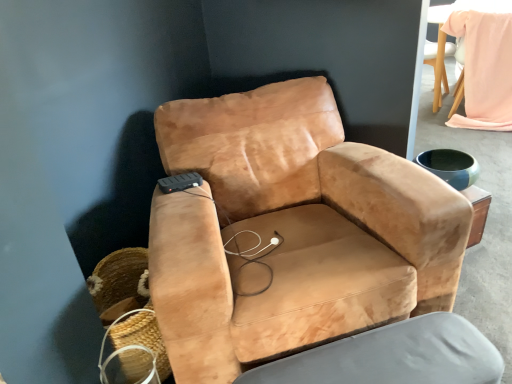
Image resolution: width=512 pixels, height=384 pixels. What do you see at coordinates (134, 350) in the screenshot? I see `woven straw basket at lower left` at bounding box center [134, 350].

The height and width of the screenshot is (384, 512). In order to click on woven straw basket at lower left in this screenshot , I will do `click(134, 350)`.

Is light pink fabric bean bag chair at upper right bigger than suede tan armchair at center?

Actually, light pink fabric bean bag chair at upper right might be smaller than suede tan armchair at center.

Is light pink fabric bean bag chair at upper right situated inside suede tan armchair at center or outside?

light pink fabric bean bag chair at upper right is spatially situated outside suede tan armchair at center.

Is the surface of light pink fabric bean bag chair at upper right in direct contact with suede tan armchair at center?

light pink fabric bean bag chair at upper right and suede tan armchair at center are not in contact.

From a real-world perspective, relative to suede tan armchair at center, is light pink fabric bean bag chair at upper right vertically above or below?

In terms of real-world spatial position, light pink fabric bean bag chair at upper right is below suede tan armchair at center.

From a real-world perspective, who is located lower, suede-like tan swivel chair at center or light pink fabric bean bag chair at upper right?

From a 3D spatial view, suede-like tan swivel chair at center is below.

Is light pink fabric bean bag chair at upper right at the back of suede-like tan swivel chair at center?

No, suede-like tan swivel chair at center is not facing the opposite direction of light pink fabric bean bag chair at upper right.

Looking at this image, between suede-like tan swivel chair at center and light pink fabric bean bag chair at upper right, which one has less height?

Standing shorter between the two is suede-like tan swivel chair at center.

The width and height of the screenshot is (512, 384). Find the location of `swivel chair that appears below the light pink fabric bean bag chair at upper right (from a real-world perspective)`. swivel chair that appears below the light pink fabric bean bag chair at upper right (from a real-world perspective) is located at coordinates (392, 356).

Which of these two, suede tan armchair at center or woven straw basket at lower left, stands shorter?

woven straw basket at lower left.

Considering the positions of objects suede tan armchair at center and woven straw basket at lower left in the image provided, who is in front, suede tan armchair at center or woven straw basket at lower left?

suede tan armchair at center is closer to the camera.

Considering the positions of objects suede tan armchair at center and woven straw basket at lower left in the image provided, who is more to the left, suede tan armchair at center or woven straw basket at lower left?

woven straw basket at lower left.

You are a GUI agent. You are given a task and a screenshot of the screen. Output one action in this format:
    pyautogui.click(x=<x>, y=<y>)
    Task: Click on the basket directly beneath the suede tan armchair at center (from a real-world perspective)
    
    Given the screenshot: What is the action you would take?
    click(x=134, y=350)

Who is bigger, suede tan armchair at center or suede-like tan swivel chair at center?

suede tan armchair at center.

Is suede tan armchair at center situated inside suede-like tan swivel chair at center or outside?

suede tan armchair at center is spatially situated outside suede-like tan swivel chair at center.

Which is behind, point (245, 205) or point (426, 370)?

The point (245, 205) is farther.

Is suede tan armchair at center next to suede-like tan swivel chair at center?

They are not placed beside each other.

From a real-world perspective, is woven straw basket at lower left above or below suede tan armchair at center?

In terms of real-world spatial position, woven straw basket at lower left is below suede tan armchair at center.

Considering the sizes of woven straw basket at lower left and suede tan armchair at center in the image, is woven straw basket at lower left wider or thinner than suede tan armchair at center?

Clearly, woven straw basket at lower left has less width compared to suede tan armchair at center.

Considering the points (138, 336) and (301, 209), which point is behind, point (138, 336) or point (301, 209)?

The point (301, 209) is more distant.

Identify the location of basket on the left of suede tan armchair at center. The height and width of the screenshot is (384, 512). (134, 350).

Is suede tan armchair at center wider than light pink fabric bean bag chair at upper right?

Indeed, suede tan armchair at center has a greater width compared to light pink fabric bean bag chair at upper right.

Is point (388, 273) more distant than point (472, 120)?

No, (388, 273) is in front of (472, 120).

Between suede tan armchair at center and light pink fabric bean bag chair at upper right, which one has more height?

suede tan armchair at center is taller.

Consider the image. Considering the positions of objects suede tan armchair at center and light pink fabric bean bag chair at upper right in the image provided, who is behind, suede tan armchair at center or light pink fabric bean bag chair at upper right?

light pink fabric bean bag chair at upper right is more distant.

Image resolution: width=512 pixels, height=384 pixels. Identify the location of basket on the left of light pink fabric bean bag chair at upper right. (134, 350).

Is woven straw basket at lower left wider than light pink fabric bean bag chair at upper right?

Incorrect, the width of woven straw basket at lower left does not surpass that of light pink fabric bean bag chair at upper right.

Is woven straw basket at lower left taller or shorter than light pink fabric bean bag chair at upper right?

Clearly, woven straw basket at lower left is shorter compared to light pink fabric bean bag chair at upper right.

Considering the sizes of objects woven straw basket at lower left and light pink fabric bean bag chair at upper right in the image provided, who is smaller, woven straw basket at lower left or light pink fabric bean bag chair at upper right?

woven straw basket at lower left.

This screenshot has height=384, width=512. I want to click on chair below the light pink fabric bean bag chair at upper right (from the image's perspective), so click(x=290, y=231).

Identify the location of bean bag chair lying behind the suede-like tan swivel chair at center. The width and height of the screenshot is (512, 384). (485, 69).

From the image, which object appears to be nearer to woven straw basket at lower left, light pink fabric bean bag chair at upper right or suede tan armchair at center?

Based on the image, suede tan armchair at center appears to be nearer to woven straw basket at lower left.

Looking at this image, estimate the real-world distances between objects in this image. Which object is further from suede tan armchair at center, woven straw basket at lower left or suede-like tan swivel chair at center?

Among the two, woven straw basket at lower left is located further to suede tan armchair at center.

Based on their spatial positions, is light pink fabric bean bag chair at upper right or suede-like tan swivel chair at center further from suede tan armchair at center?

light pink fabric bean bag chair at upper right is positioned further to the anchor suede tan armchair at center.

Based on their spatial positions, is suede-like tan swivel chair at center or suede tan armchair at center closer to light pink fabric bean bag chair at upper right?

Based on the image, suede tan armchair at center appears to be nearer to light pink fabric bean bag chair at upper right.

Estimate the real-world distances between objects in this image. Which object is closer to suede tan armchair at center, suede-like tan swivel chair at center or woven straw basket at lower left?

suede-like tan swivel chair at center lies closer to suede tan armchair at center than the other object.

Based on the photo, when comparing their distances from light pink fabric bean bag chair at upper right, does suede tan armchair at center or suede-like tan swivel chair at center seem further?

Among the two, suede-like tan swivel chair at center is located further to light pink fabric bean bag chair at upper right.

Which object lies further to the anchor point woven straw basket at lower left, suede tan armchair at center or suede-like tan swivel chair at center?

suede-like tan swivel chair at center lies further to woven straw basket at lower left than the other object.

In the scene shown: Estimate the real-world distances between objects in this image. Which object is further from suede tan armchair at center, suede-like tan swivel chair at center or light pink fabric bean bag chair at upper right?

Among the two, light pink fabric bean bag chair at upper right is located further to suede tan armchair at center.

This screenshot has height=384, width=512. Identify the location of swivel chair between suede tan armchair at center and light pink fabric bean bag chair at upper right from front to back. pyautogui.click(x=392, y=356).

The height and width of the screenshot is (384, 512). Identify the location of chair situated between woven straw basket at lower left and light pink fabric bean bag chair at upper right from left to right. (290, 231).

Find the location of a particular element. The height and width of the screenshot is (384, 512). swivel chair between woven straw basket at lower left and light pink fabric bean bag chair at upper right from left to right is located at coordinates (392, 356).

Locate an element on the screen. This screenshot has height=384, width=512. chair between woven straw basket at lower left and suede-like tan swivel chair at center in the horizontal direction is located at coordinates (290, 231).